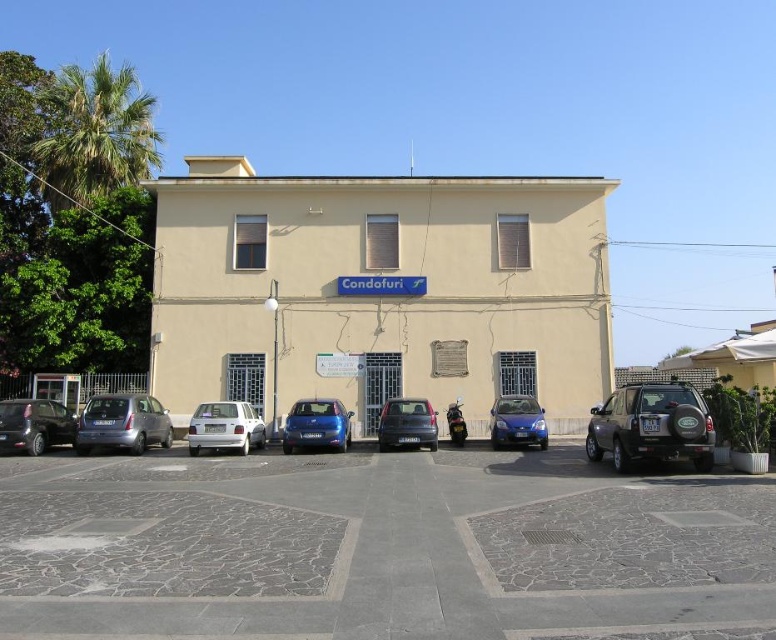
Question: Which of these objects is positioned farthest from the glossy blue hatchback at center?

Choices:
 (A) blue metallic hatchback at center
 (B) gray stone parking lot at center
 (C) matte black car at center

Answer: (B)

Question: Can you confirm if dark gray metallic suv at right is wider than shiny black car at lower left?

Choices:
 (A) yes
 (B) no

Answer: (B)

Question: Which object is farther from the camera taking this photo?

Choices:
 (A) gray stone parking lot at center
 (B) satin silver hatchback at lower left

Answer: (B)

Question: Which object appears farthest from the camera in this image?

Choices:
 (A) matte black car at center
 (B) satin silver hatchback at lower left

Answer: (A)

Question: Does dark gray metallic suv at right have a smaller size compared to white matte sedan at center?

Choices:
 (A) no
 (B) yes

Answer: (B)

Question: Does matte black car at center appear under blue metallic hatchback at center?

Choices:
 (A) yes
 (B) no

Answer: (A)